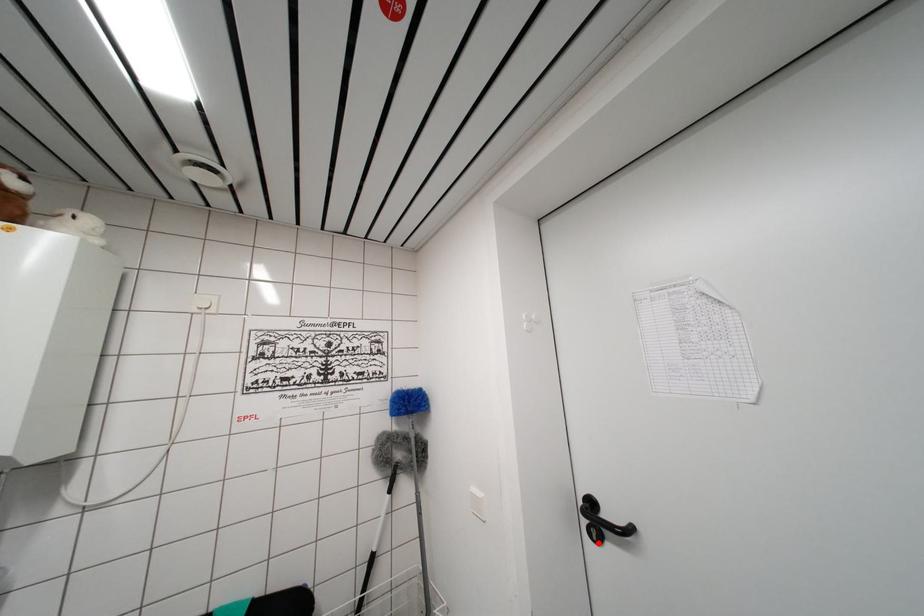
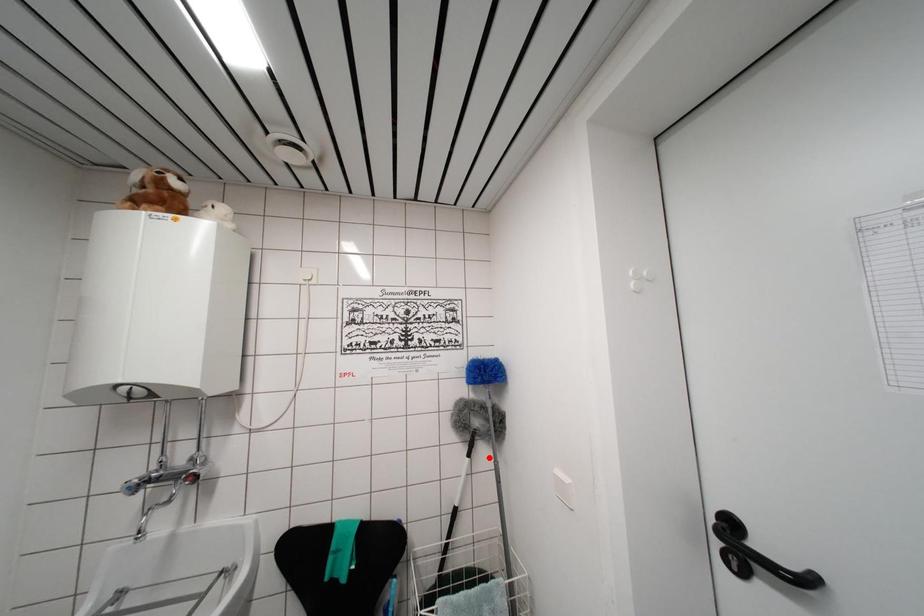
I am providing you with two images of the same scene from different viewpoints. A red point is marked on the first image and another point is marked on the second image. Are the points marked in image1 and image2 representing the same 3D position?

No